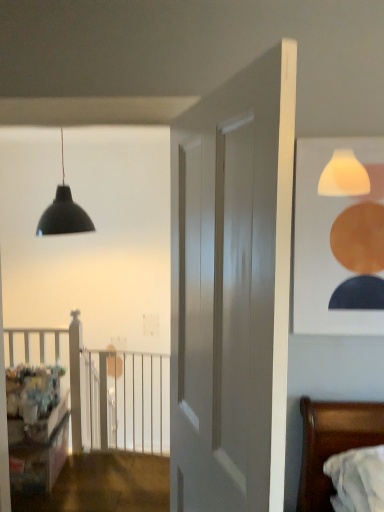
This screenshot has width=384, height=512. What do you see at coordinates (64, 212) in the screenshot? I see `matte black pendant light at upper left` at bounding box center [64, 212].

This screenshot has width=384, height=512. Describe the element at coordinates (332, 443) in the screenshot. I see `wooden bed at lower right` at that location.

Locate an element on the screen. matte black pendant light at upper left is located at coordinates (64, 212).

Is wooden dresser at lower left not within wooden bed at lower right?

wooden dresser at lower left lies outside wooden bed at lower right's area.

Which object is wider, wooden dresser at lower left or wooden bed at lower right?

wooden dresser at lower left is wider.

Would you say wooden dresser at lower left is a long distance from wooden bed at lower right?

wooden dresser at lower left is positioned a significant distance from wooden bed at lower right.

From the image's perspective, is wooden dresser at lower left on top of wooden bed at lower right?

No, from the image's perspective, wooden dresser at lower left is not above wooden bed at lower right.

Which object is wider, white metal balustrade at center or matte white picture frame at upper right?

Wider between the two is white metal balustrade at center.

Is white metal balustrade at center in front of or behind matte white picture frame at upper right in the image?

Visually, white metal balustrade at center is located behind matte white picture frame at upper right.

Could you tell me if white metal balustrade at center is turned towards matte white picture frame at upper right?

No, white metal balustrade at center is not aimed at matte white picture frame at upper right.

Which object is positioned more to the right, white metal balustrade at center or matte white picture frame at upper right?

matte white picture frame at upper right is more to the right.

From the picture: From the image's perspective, does matte white picture frame at upper right appear higher than wooden dresser at lower left?

Yes.

From a real-world perspective, which object stands above the other?

From a 3D spatial view, matte white picture frame at upper right is above.

In the scene shown: Which object is positioned more to the right, matte black pendant light at upper left or white metal balustrade at center?

Positioned to the right is white metal balustrade at center.

Between point (75, 232) and point (105, 366), which one is positioned in front?

Positioned in front is point (105, 366).

Is matte black pendant light at upper left positioned far away from white metal balustrade at center?

Indeed, matte black pendant light at upper left is not near white metal balustrade at center.

Is point (347, 448) closer to viewer compared to point (112, 441)?

Yes, it is.

From a real-world perspective, is wooden bed at lower right positioned over white metal balustrade at center based on gravity?

Yes, from a real-world perspective, wooden bed at lower right is on top of white metal balustrade at center.

From the picture: Do you think wooden bed at lower right is within white metal balustrade at center, or outside of it?

wooden bed at lower right cannot be found inside white metal balustrade at center.

Is wooden bed at lower right positioned with its back to white metal balustrade at center?

wooden bed at lower right is not turned away from white metal balustrade at center.

In the scene shown: From a real-world perspective, is white metal balustrade at center on top of wooden dresser at lower left?

No, from a real-world perspective, white metal balustrade at center is not on top of wooden dresser at lower left.

Is the surface of white metal balustrade at center in direct contact with wooden dresser at lower left?

They are not placed beside each other.

Considering the sizes of white metal balustrade at center and wooden dresser at lower left in the image, is white metal balustrade at center taller or shorter than wooden dresser at lower left?

Considering their sizes, white metal balustrade at center has more height than wooden dresser at lower left.

Which is in front, point (202, 175) or point (66, 193)?

The point (202, 175) is more forward.

Is matte black pendant light at upper left completely or partially inside white smooth door at center?

Actually, matte black pendant light at upper left is outside white smooth door at center.

How much distance is there between white smooth door at center and matte black pendant light at upper left?

The distance of white smooth door at center from matte black pendant light at upper left is 7.73 feet.

Can you confirm if white smooth door at center is smaller than matte black pendant light at upper left?

Indeed, white smooth door at center has a smaller size compared to matte black pendant light at upper left.

The width and height of the screenshot is (384, 512). Identify the location of bed lying on the right of wooden dresser at lower left. (332, 443).

What are the coordinates of `picture frame in front of the white metal balustrade at center` in the screenshot? It's located at (325, 241).

Considering their positions, is matte black pendant light at upper left positioned closer to wooden bed at lower right than wooden dresser at lower left?

Among the two, wooden dresser at lower left is located nearer to wooden bed at lower right.

In the scene shown: When comparing their distances from wooden dresser at lower left, does wooden bed at lower right or matte black pendant light at upper left seem further?

wooden bed at lower right is positioned further to the anchor wooden dresser at lower left.

Estimate the real-world distances between objects in this image. Which object is further from white smooth door at center, matte white picture frame at upper right or matte black pendant light at upper left?

Among the two, matte black pendant light at upper left is located further to white smooth door at center.

When comparing their distances from matte white picture frame at upper right, does matte black pendant light at upper left or wooden dresser at lower left seem closer?

wooden dresser at lower left is positioned closer to the anchor matte white picture frame at upper right.

Estimate the real-world distances between objects in this image. Which object is closer to white metal balustrade at center, matte black pendant light at upper left or matte white picture frame at upper right?

Among the two, matte black pendant light at upper left is located nearer to white metal balustrade at center.

Estimate the real-world distances between objects in this image. Which object is further from matte black pendant light at upper left, white metal balustrade at center or wooden dresser at lower left?

Based on the image, wooden dresser at lower left appears to be further to matte black pendant light at upper left.

Based on their spatial positions, is white smooth door at center or white metal balustrade at center closer to matte white picture frame at upper right?

white smooth door at center is closer to matte white picture frame at upper right.

Looking at the image, which one is located closer to wooden dresser at lower left, white smooth door at center or wooden bed at lower right?

The object closer to wooden dresser at lower left is white smooth door at center.

Find the location of a particular element. Image resolution: width=384 pixels, height=512 pixels. balustrade between matte black pendant light at upper left and wooden dresser at lower left from top to bottom is located at coordinates (126, 401).

I want to click on door between wooden dresser at lower left and matte white picture frame at upper right, so click(x=232, y=290).

Where is `picture frame located between wooden dresser at lower left and wooden bed at lower right in the left-right direction`? Image resolution: width=384 pixels, height=512 pixels. picture frame located between wooden dresser at lower left and wooden bed at lower right in the left-right direction is located at coordinates (325, 241).

You are a GUI agent. You are given a task and a screenshot of the screen. Output one action in this format:
    pyautogui.click(x=<x>, y=<y>)
    Task: Click on the picture frame between white smooth door at center and matte black pendant light at upper left from front to back
    
    Given the screenshot: What is the action you would take?
    pyautogui.click(x=325, y=241)